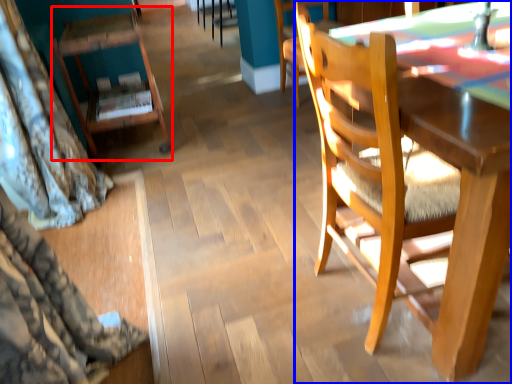
Question: Among these objects, which one is nearest to the camera, chair (highlighted by a red box) or chair (highlighted by a blue box)?

Choices:
 (A) chair
 (B) chair

Answer: (B)